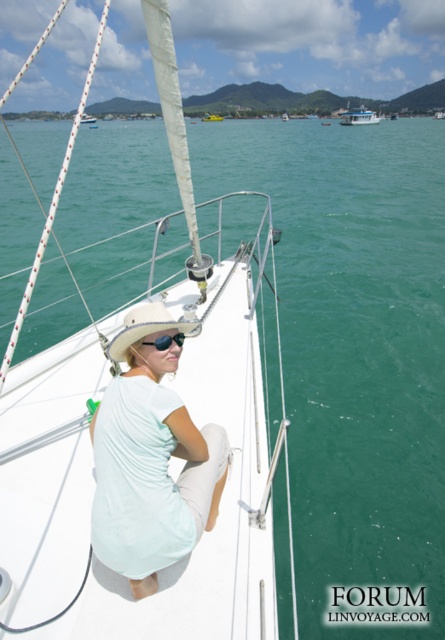
You are an observer on the deck of the sailboat. You see the white plastic boat at upper center and the white matte sailboat at upper left. Which one is narrower?

The white plastic boat at upper center is narrower than the white matte sailboat at upper left.